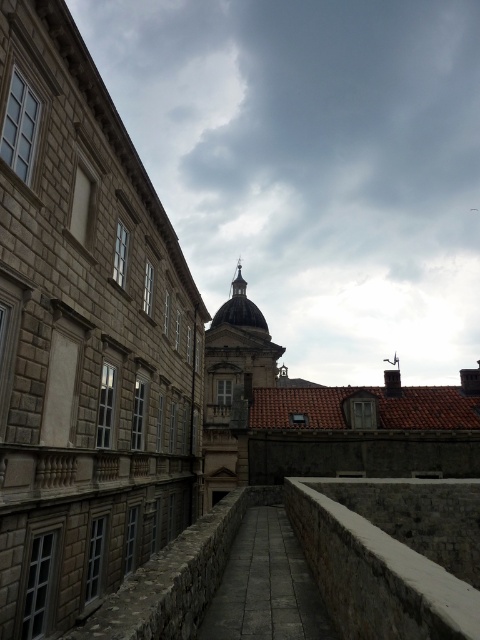
Consider the image. Between white stone ledge at center and brown stone ledge at center, which one is positioned lower?

brown stone ledge at center

Does white stone ledge at center appear on the left side of brown stone ledge at center?

No, white stone ledge at center is not to the left of brown stone ledge at center.

Locate an element on the screen. white stone ledge at center is located at coordinates (392, 554).